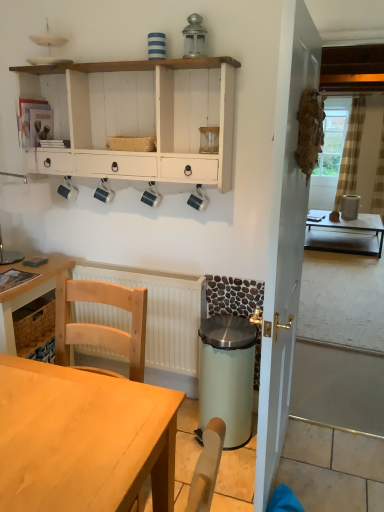
You are a GUI agent. You are given a task and a screenshot of the screen. Output one action in this format:
    pyautogui.click(x=<x>, y=<y>)
    Task: Click on the free location to the left of metallic lantern at upper center
    
    Given the screenshot: What is the action you would take?
    162,65